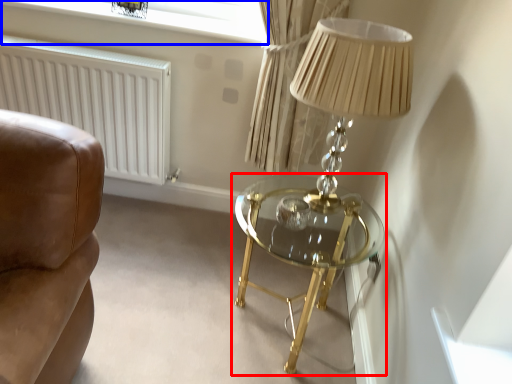
Question: Which object is further to the camera taking this photo, table (highlighted by a red box) or window screen (highlighted by a blue box)?

Choices:
 (A) table
 (B) window screen

Answer: (B)